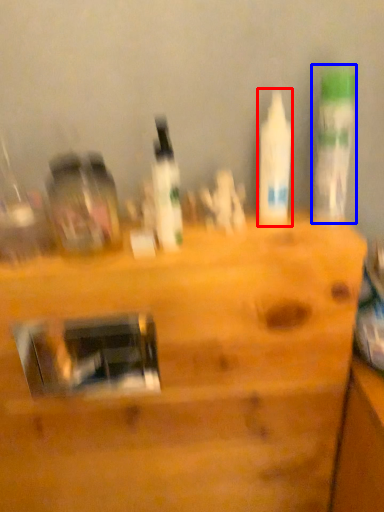
Question: Which point is closer to the camera, bottle (highlighted by a red box) or bottle (highlighted by a blue box)?

Choices:
 (A) bottle
 (B) bottle

Answer: (B)